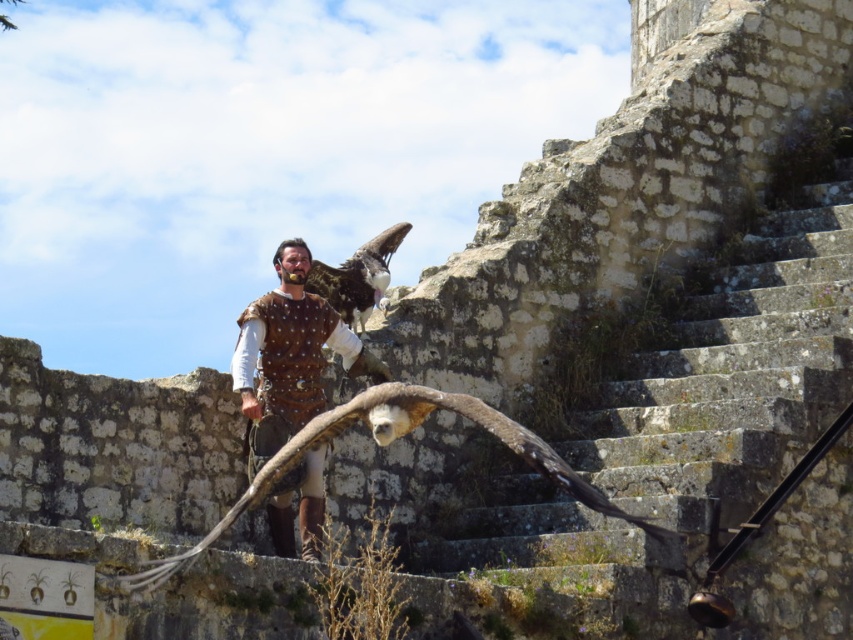
Is brown leather vest at center above brown feathered eagle at center?

No.

Between brown leather vest at center and brown feathered eagle at center, which one is positioned higher?

brown feathered eagle at center is higher up.

Locate an element on the screen. This screenshot has height=640, width=853. brown leather vest at center is located at coordinates (289, 355).

Who is lower down, brown feathered falcon at center or brown feathered eagle at center?

Positioned lower is brown feathered falcon at center.

Consider the image. Who is taller, brown feathered falcon at center or brown feathered eagle at center?

Standing taller between the two is brown feathered eagle at center.

Image resolution: width=853 pixels, height=640 pixels. Identify the location of brown feathered falcon at center. (386, 444).

Between brown leather vest at center and brown feathered falcon at center, which one is positioned higher?

brown leather vest at center is higher up.

Who is positioned more to the right, brown leather vest at center or brown feathered falcon at center?

From the viewer's perspective, brown feathered falcon at center appears more on the right side.

Does point (276, 554) come closer to viewer compared to point (347, 422)?

That is False.

At what (x,y) coordinates should I click in order to perform the action: click on brown leather vest at center. Please return your answer as a coordinate pair (x, y). The height and width of the screenshot is (640, 853). Looking at the image, I should click on (289, 355).